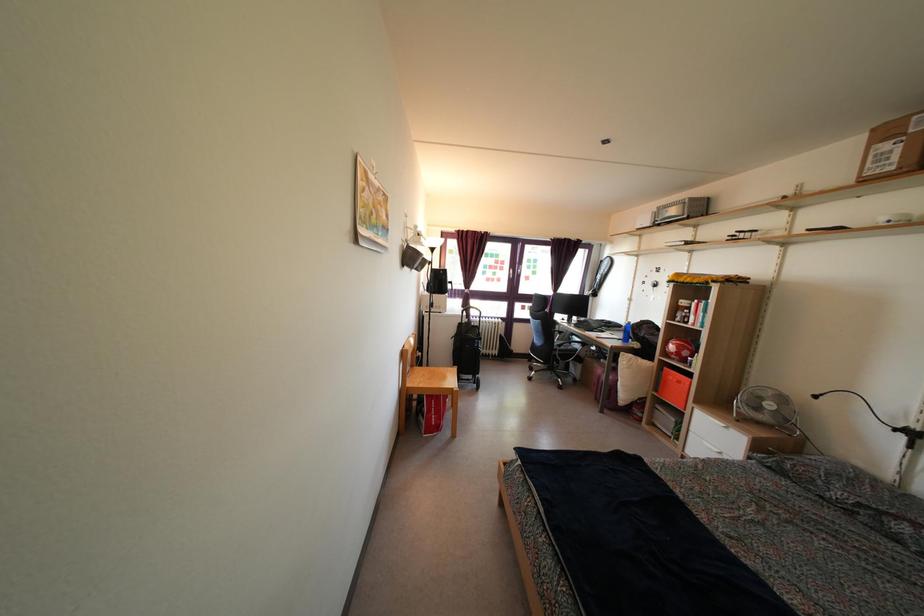
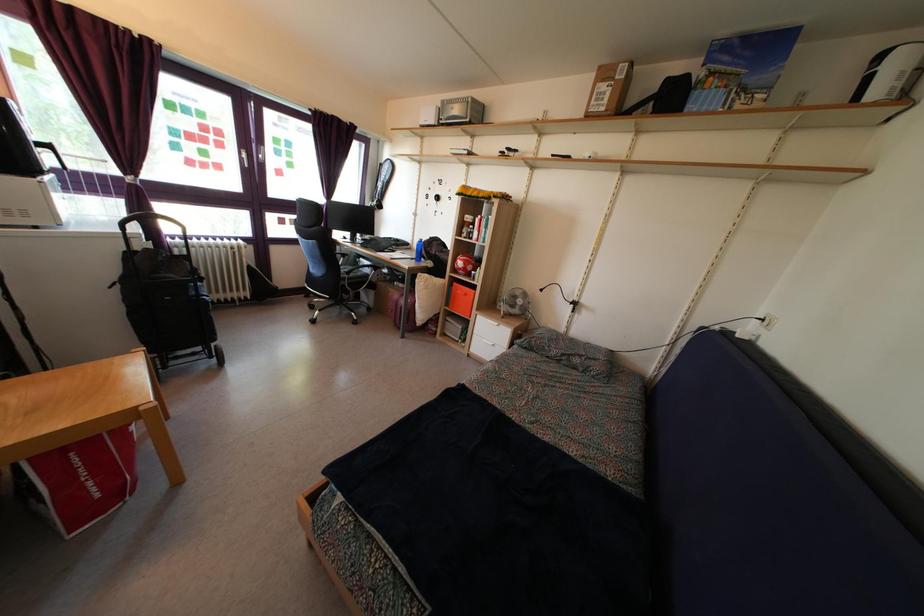
The point at (563, 354) is marked in the first image. Where is the corresponding point in the second image?

(350, 282)